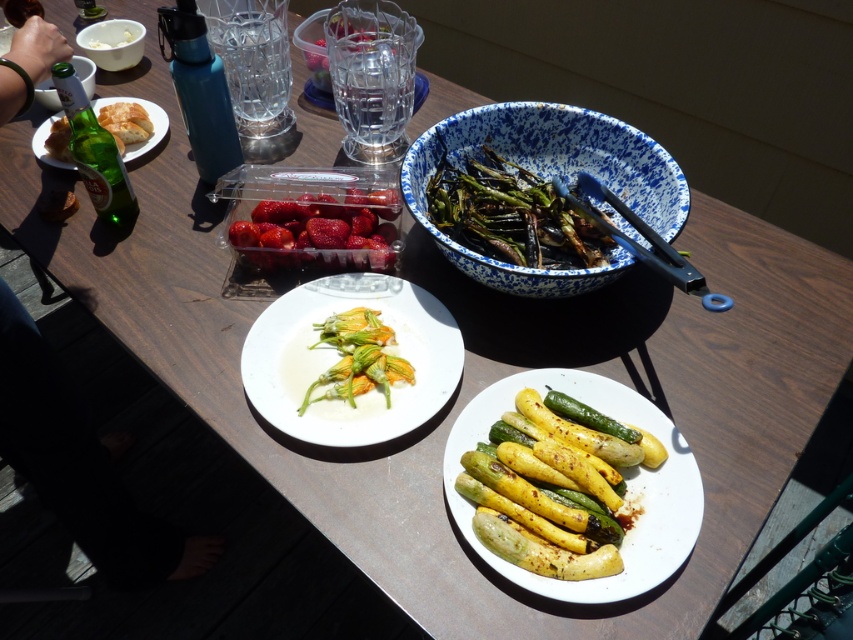
Does blue speckled bowl at upper right have a lesser height compared to charcoal grilled asparagus at center?

In fact, blue speckled bowl at upper right may be taller than charcoal grilled asparagus at center.

Is blue speckled bowl at upper right behind charcoal grilled asparagus at center?

No, blue speckled bowl at upper right is in front of charcoal grilled asparagus at center.

The height and width of the screenshot is (640, 853). I want to click on blue speckled bowl at upper right, so (x=548, y=179).

Is blue speckled bowl at upper right taller than white matte plate at center?

Yes.

Consider the image. Can you confirm if blue speckled bowl at upper right is positioned to the left of white matte plate at center?

No, blue speckled bowl at upper right is not to the left of white matte plate at center.

I want to click on blue speckled bowl at upper right, so click(x=548, y=179).

Where is `blue speckled bowl at upper right`? blue speckled bowl at upper right is located at coordinates (548, 179).

Is red glossy strawberries at upper center positioned before white matte bowl at upper center?

Yes.

Is red glossy strawberries at upper center to the right of white matte bowl at upper center from the viewer's perspective?

Answer: Correct, you'll find red glossy strawberries at upper center to the right of white matte bowl at upper center.

Find the location of a particular element. This screenshot has width=853, height=640. red glossy strawberries at upper center is located at coordinates (318, 230).

Locate an element on the screen. The height and width of the screenshot is (640, 853). red glossy strawberries at upper center is located at coordinates (x=318, y=230).